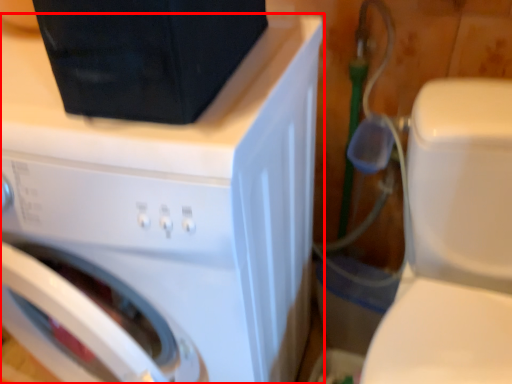
Question: From the image's perspective, what is the correct spatial relationship of washing machine (annotated by the red box) in relation to washer?

Choices:
 (A) above
 (B) below

Answer: (A)